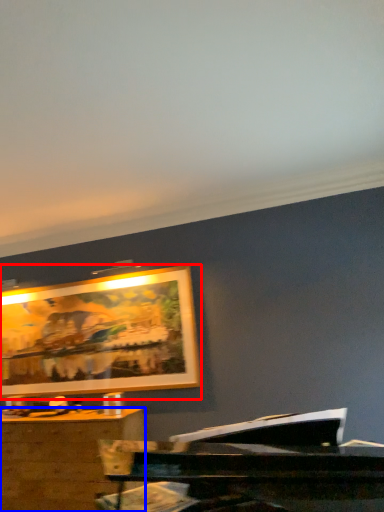
Question: Which object appears closest to the camera in this image, picture frame (highlighted by a red box) or desk (highlighted by a blue box)?

Choices:
 (A) picture frame
 (B) desk

Answer: (B)